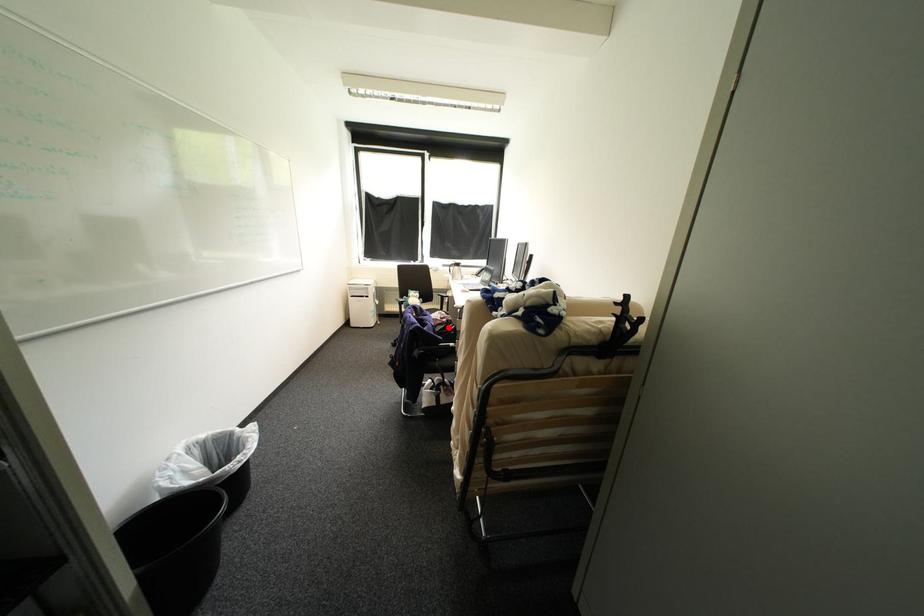
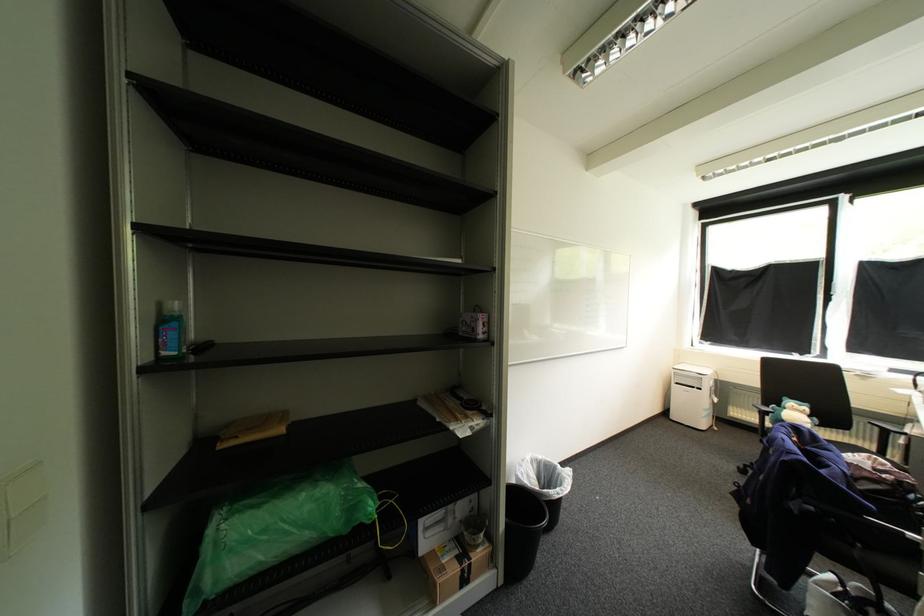
Question: I am providing you with two images of the same scene from different viewpoints. Image1 has a red point marked. In image2, the corresponding 3D location appears at what relative position? Reply with the corresponding letter.

Choices:
 (A) Closer
 (B) Farther

Answer: (B)